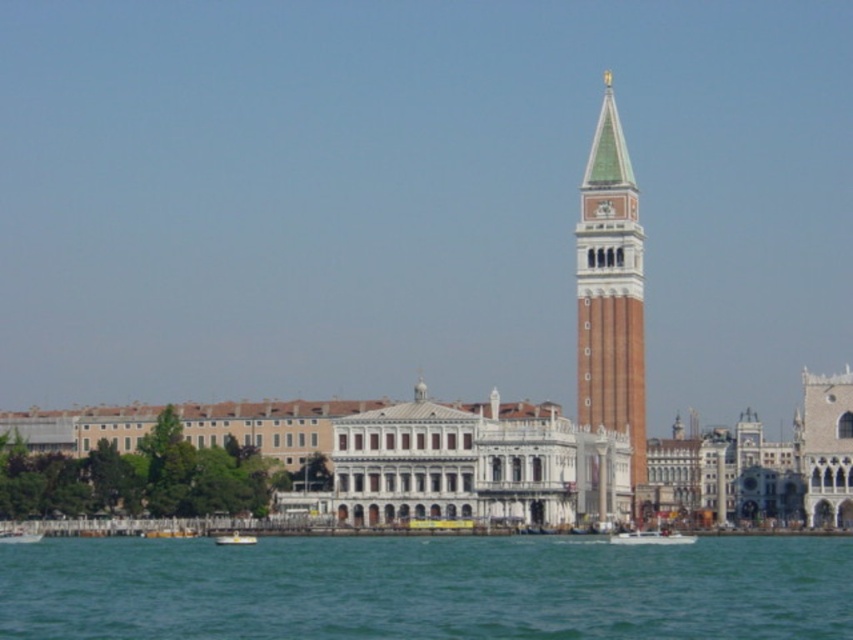
Which is more to the right, blue water at lower center or brick tower at center?

Positioned to the right is brick tower at center.

Does blue water at lower center have a greater height compared to brick tower at center?

No, blue water at lower center is not taller than brick tower at center.

Is point (637, 548) closer to viewer compared to point (595, 410)?

Yes.

In order to click on blue water at lower center in this screenshot , I will do click(x=426, y=588).

Based on the photo, can you confirm if blue water at lower center is shorter than white plastic boat at lower center?

In fact, blue water at lower center may be taller than white plastic boat at lower center.

Between point (195, 588) and point (236, 536), which one is positioned behind?

Positioned behind is point (236, 536).

In order to click on blue water at lower center in this screenshot , I will do `click(426, 588)`.

Consider the image. Is brick tower at center wider than white plastic boat at lower left?

Correct, the width of brick tower at center exceeds that of white plastic boat at lower left.

How much distance is there between brick tower at center and white plastic boat at lower left?

brick tower at center is 37.74 meters from white plastic boat at lower left.

You are a GUI agent. You are given a task and a screenshot of the screen. Output one action in this format:
    pyautogui.click(x=<x>, y=<y>)
    Task: Click on the brick tower at center
    The width and height of the screenshot is (853, 640).
    Given the screenshot: What is the action you would take?
    (611, 296)